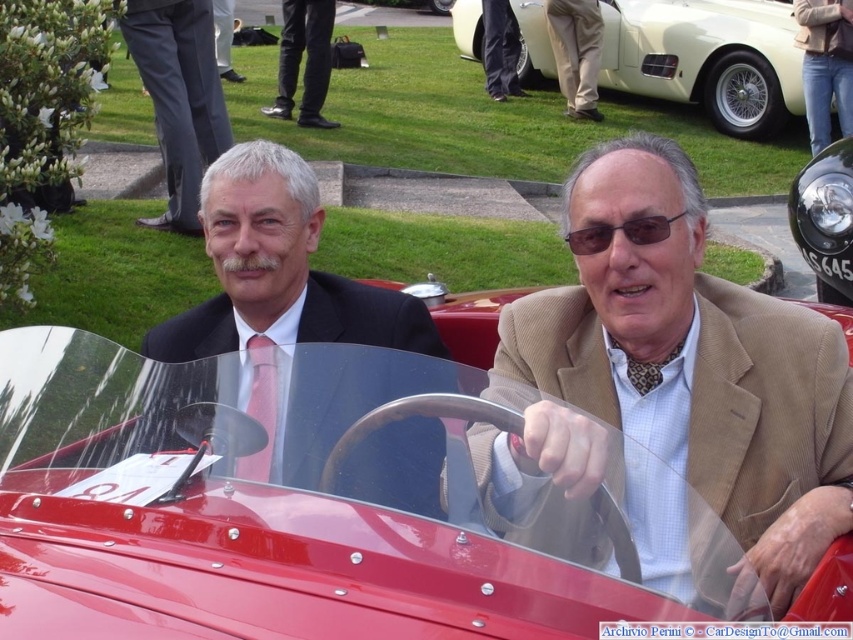
You are standing in front of the vintage red convertible car and want to locate the tan fabric pants at center. Based on the coordinates provided, where would you look relative to the car?

The tan fabric pants at center are located at coordinates point (576, 52), which would be near the lower left area of the car.

You are a photographer at the classic car event and want to capture a closeup of the black leather shoes at center and the dark brown textured sunglasses at center. Since your camera can only focus on one object at a time, which object should you focus on to ensure the other is still in the background?

You should focus on the black leather shoes at center because they are located above the dark brown textured sunglasses at center, meaning the sunglasses will be in the background and still visible.